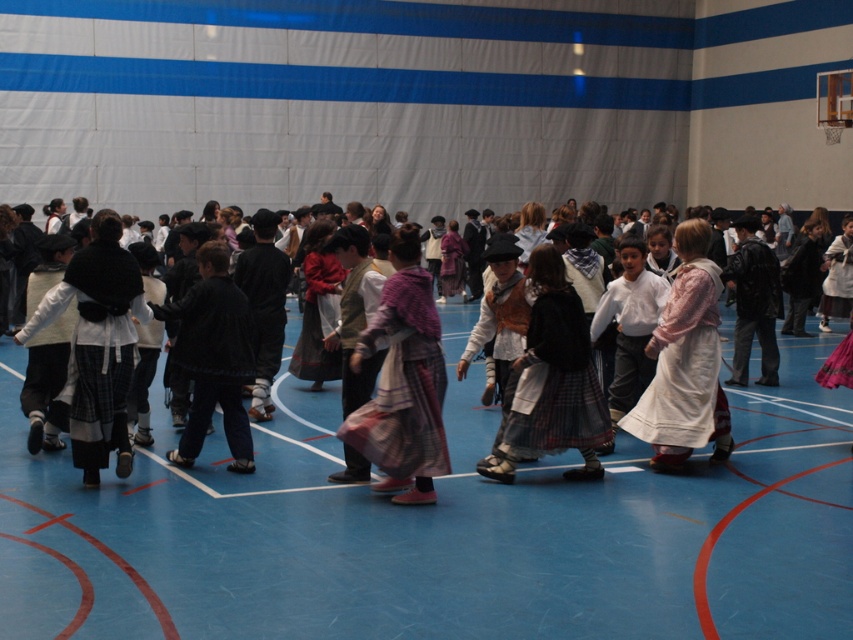
Is blue rubber basketball court at center below white cotton shirt at center?

Correct, blue rubber basketball court at center is located below white cotton shirt at center.

Between blue rubber basketball court at center and white cotton shirt at center, which one is positioned higher?

white cotton shirt at center is above.

Who is more distant from viewer, (x=786, y=600) or (x=631, y=352)?

Positioned behind is point (x=631, y=352).

I want to click on blue rubber basketball court at center, so click(465, 528).

Which of these two, white cotton dress at center or white cotton shirt at center, stands taller?

white cotton dress at center is taller.

Can you confirm if white cotton dress at center is thinner than white cotton shirt at center?

No, white cotton dress at center is not thinner than white cotton shirt at center.

Which is in front, point (547, 436) or point (631, 326)?

Point (547, 436) is more forward.

This screenshot has width=853, height=640. Identify the location of white cotton dress at center. (554, 380).

Which is more to the left, blue rubber basketball court at center or white cotton dress at center?

blue rubber basketball court at center is more to the left.

Is blue rubber basketball court at center in front of white cotton dress at center?

Yes.

Between point (422, 545) and point (544, 433), which one is positioned behind?

Positioned behind is point (544, 433).

I want to click on blue rubber basketball court at center, so click(465, 528).